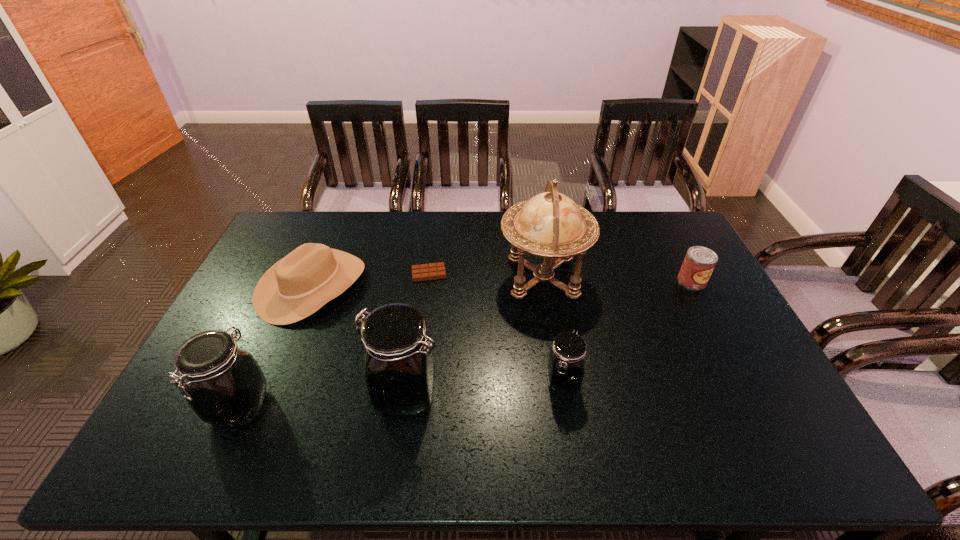
This screenshot has height=540, width=960. Find the location of `the third closest jar to the tallest object`. the third closest jar to the tallest object is located at coordinates (224, 385).

You are a GUI agent. You are given a task and a screenshot of the screen. Output one action in this format:
    pyautogui.click(x=<x>, y=<y>)
    Task: Click on the free spot that satisfies the following two spatial constraints: 1. on the back side of the rightmost object; 2. on the front-facing side of the globe
    
    Given the screenshot: What is the action you would take?
    pyautogui.click(x=690, y=278)